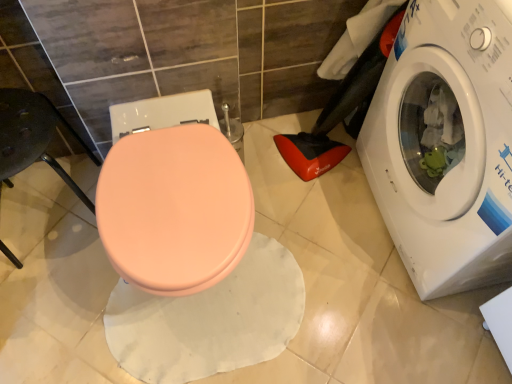
Describe the element at coordinates (174, 209) in the screenshot. This screenshot has width=512, height=384. I see `matte pink bidet at center` at that location.

Where is `white glossy washing machine at right`? white glossy washing machine at right is located at coordinates (446, 144).

What do you see at coordinates (32, 136) in the screenshot? This screenshot has width=512, height=384. I see `matte pink seat at left` at bounding box center [32, 136].

The height and width of the screenshot is (384, 512). I want to click on matte pink bidet at center, so click(174, 209).

Considering the relative sizes of matte pink seat at left and white glossy washing machine at right in the image provided, is matte pink seat at left shorter than white glossy washing machine at right?

Indeed, matte pink seat at left has a lesser height compared to white glossy washing machine at right.

Based on their sizes in the image, would you say matte pink seat at left is bigger or smaller than white glossy washing machine at right?

Considering their sizes, matte pink seat at left takes up less space than white glossy washing machine at right.

Can you confirm if matte pink seat at left is wider than white glossy washing machine at right?

In fact, matte pink seat at left might be narrower than white glossy washing machine at right.

Is point (42, 145) closer to viewer compared to point (391, 220)?

Yes, it is in front of point (391, 220).

How far apart are white glossy washing machine at right and matte pink bidet at center?

white glossy washing machine at right and matte pink bidet at center are 22.38 inches apart.

Which is more to the right, white glossy washing machine at right or matte pink bidet at center?

Positioned to the right is white glossy washing machine at right.

Can you tell me how much white glossy washing machine at right and matte pink bidet at center differ in facing direction?

white glossy washing machine at right and matte pink bidet at center are facing 89.4 degrees away from each other.

From the image's perspective, between white glossy washing machine at right and matte pink bidet at center, which one is located above?

white glossy washing machine at right is shown above in the image.

How many degrees apart are the facing directions of matte pink bidet at center and white glossy washing machine at right?

The facing directions of matte pink bidet at center and white glossy washing machine at right are 89.4 degrees apart.

From a real-world perspective, between matte pink bidet at center and white glossy washing machine at right, who is vertically higher?

white glossy washing machine at right is physically above.

From the image's perspective, between matte pink bidet at center and white glossy washing machine at right, which one is located above?

white glossy washing machine at right is shown above in the image.

Considering the relative sizes of matte pink bidet at center and white glossy washing machine at right in the image provided, is matte pink bidet at center bigger than white glossy washing machine at right?

Actually, matte pink bidet at center might be smaller than white glossy washing machine at right.

From the image's perspective, is matte pink bidet at center located beneath matte pink seat at left?

Yes.

Does matte pink bidet at center appear on the right side of matte pink seat at left?

Correct, you'll find matte pink bidet at center to the right of matte pink seat at left.

Based on the photo, between matte pink bidet at center and matte pink seat at left, which one is positioned behind?

Positioned behind is matte pink seat at left.

In terms of size, does matte pink bidet at center appear bigger or smaller than matte pink seat at left?

matte pink bidet at center is bigger than matte pink seat at left.

Could you tell me if white glossy washing machine at right is turned towards matte pink seat at left?

Yes, white glossy washing machine at right is oriented towards matte pink seat at left.

Is white glossy washing machine at right taller or shorter than matte pink seat at left?

white glossy washing machine at right is taller than matte pink seat at left.

Is white glossy washing machine at right wider than matte pink seat at left?

Yes, white glossy washing machine at right is wider than matte pink seat at left.

Considering the sizes of white glossy washing machine at right and matte pink seat at left in the image, is white glossy washing machine at right bigger or smaller than matte pink seat at left?

In the image, white glossy washing machine at right appears to be larger than matte pink seat at left.

Between matte pink seat at left and matte pink bidet at center, which one has larger width?

matte pink bidet at center.

Is matte pink seat at left bigger or smaller than matte pink bidet at center?

In the image, matte pink seat at left appears to be smaller than matte pink bidet at center.

Considering the points (4, 103) and (139, 267), which point is behind, point (4, 103) or point (139, 267)?

Positioned behind is point (4, 103).

Is matte pink seat at left in front of or behind matte pink bidet at center in the image?

matte pink seat at left is positioned farther from the viewer than matte pink bidet at center.

Identify the location of chair that appears below the white glossy washing machine at right (from a real-world perspective). The image size is (512, 384). (32, 136).

The width and height of the screenshot is (512, 384). There is a matte pink bidet at center. Identify the location of washing machine above it (from a real-world perspective). (446, 144).

From the image, which object appears to be nearer to matte pink seat at left, matte pink bidet at center or white glossy washing machine at right?

The object closer to matte pink seat at left is matte pink bidet at center.

From the image, which object appears to be nearer to white glossy washing machine at right, matte pink seat at left or matte pink bidet at center?

matte pink bidet at center.

Based on their spatial positions, is matte pink bidet at center or matte pink seat at left closer to white glossy washing machine at right?

matte pink bidet at center is closer to white glossy washing machine at right.

Looking at the image, which one is located closer to matte pink bidet at center, white glossy washing machine at right or matte pink seat at left?

matte pink seat at left is closer to matte pink bidet at center.

Considering their positions, is matte pink seat at left positioned closer to matte pink bidet at center than white glossy washing machine at right?

Among the two, matte pink seat at left is located nearer to matte pink bidet at center.

In the scene shown: When comparing their distances from matte pink seat at left, does white glossy washing machine at right or matte pink bidet at center seem closer?

matte pink bidet at center lies closer to matte pink seat at left than the other object.

Where is `bidet between matte pink seat at left and white glossy washing machine at right in the horizontal direction`? Image resolution: width=512 pixels, height=384 pixels. bidet between matte pink seat at left and white glossy washing machine at right in the horizontal direction is located at coordinates (174, 209).